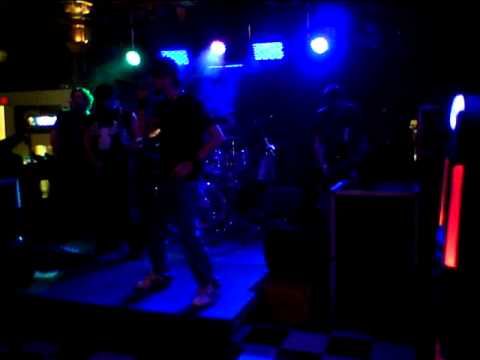
The height and width of the screenshot is (360, 480). I want to click on wall, so click(x=38, y=94).